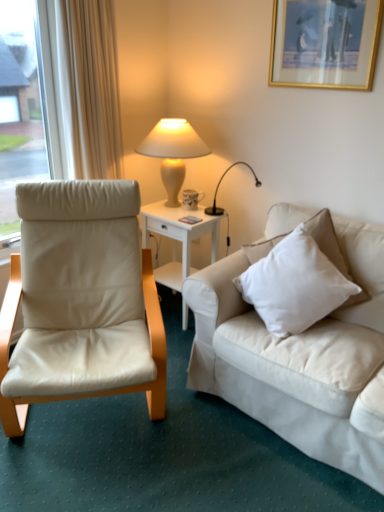
Question: Is white cotton pillow at right facing towards gold-framed picture at upper right?

Choices:
 (A) yes
 (B) no

Answer: (B)

Question: From the image's perspective, is white cotton pillow at right beneath gold-framed picture at upper right?

Choices:
 (A) no
 (B) yes

Answer: (B)

Question: Is white cotton pillow at right oriented away from gold-framed picture at upper right?

Choices:
 (A) yes
 (B) no

Answer: (B)

Question: From a real-world perspective, does white cotton pillow at right sit lower than gold-framed picture at upper right?

Choices:
 (A) yes
 (B) no

Answer: (A)

Question: Is white cotton pillow at right at the left side of gold-framed picture at upper right?

Choices:
 (A) yes
 (B) no

Answer: (A)

Question: In terms of width, does white glossy side table at center look wider or thinner when compared to beige leather chair at left?

Choices:
 (A) wide
 (B) thin

Answer: (B)

Question: From their relative heights in the image, would you say white glossy side table at center is taller or shorter than beige leather chair at left?

Choices:
 (A) short
 (B) tall

Answer: (A)

Question: From a real-world perspective, is white glossy side table at center positioned above or below beige leather chair at left?

Choices:
 (A) below
 (B) above

Answer: (A)

Question: Relative to beige leather chair at left, is white glossy side table at center in front or behind?

Choices:
 (A) front
 (B) behind

Answer: (B)

Question: Do you think porcelain floral mug at side table is within white glossy side table at center, or outside of it?

Choices:
 (A) inside
 (B) outside

Answer: (B)

Question: From the image's perspective, is porcelain floral mug at side table positioned above or below white glossy side table at center?

Choices:
 (A) below
 (B) above

Answer: (B)

Question: Is point (187, 193) positioned closer to the camera than point (206, 222)?

Choices:
 (A) farther
 (B) closer

Answer: (A)

Question: Visually, is porcelain floral mug at side table positioned to the left or to the right of white glossy side table at center?

Choices:
 (A) left
 (B) right

Answer: (B)

Question: From their relative heights in the image, would you say beige leather chair at left is taller or shorter than gold-framed picture at upper right?

Choices:
 (A) tall
 (B) short

Answer: (A)

Question: Is point (94, 388) positioned closer to the camera than point (375, 10)?

Choices:
 (A) closer
 (B) farther

Answer: (A)